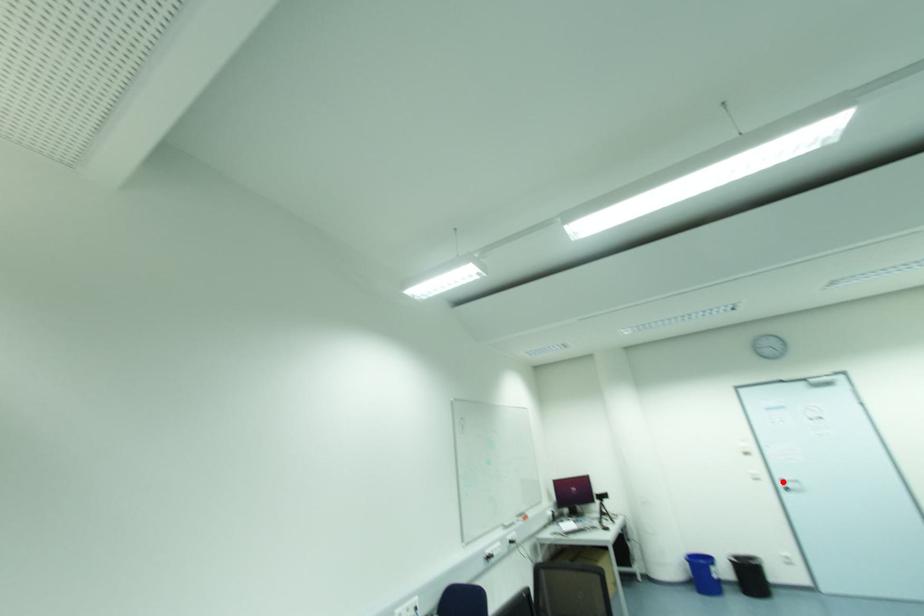
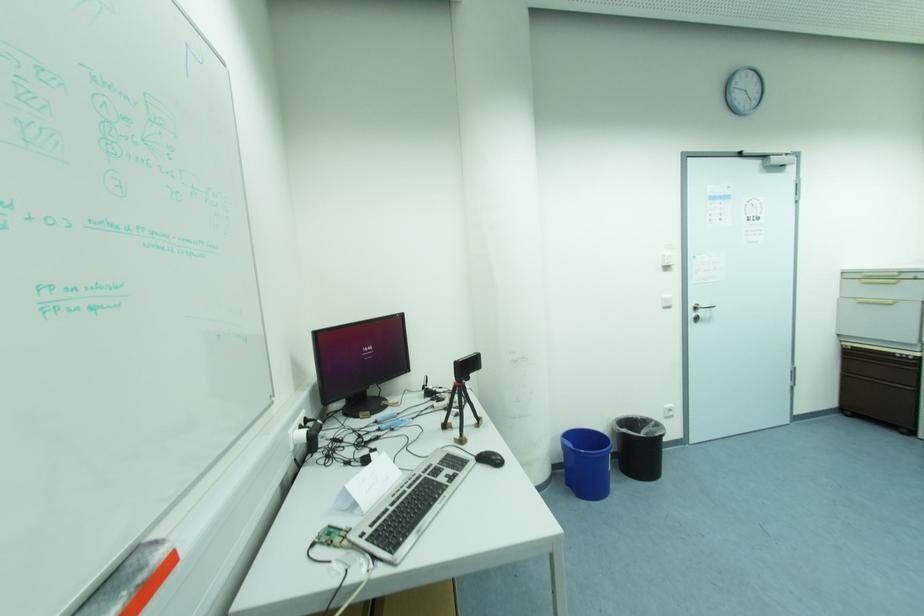
Question: I am providing you with two images of the same scene from different viewpoints. A red point is shown in image1. For the corresponding object point in image2, is it positioned nearer or farther from the camera?

Choices:
 (A) Nearer
 (B) Farther

Answer: (B)